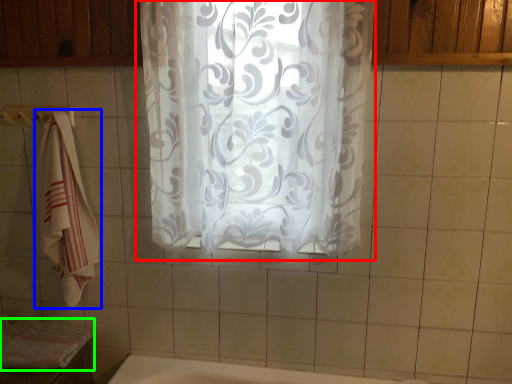
Question: Based on their relative distances, which object is nearer to curtain (highlighted by a red box)? Choose from towel (highlighted by a blue box) and bath towel (highlighted by a green box).

Choices:
 (A) towel
 (B) bath towel

Answer: (A)